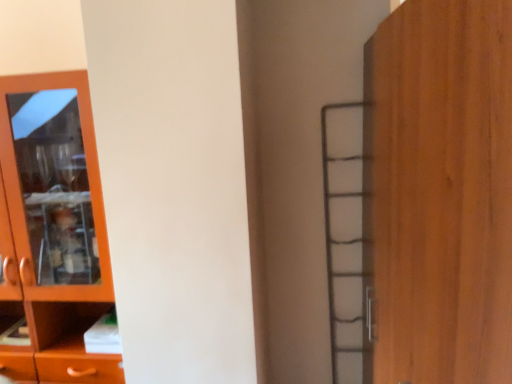
What is the approximate width of wooden door at right?

The width of wooden door at right is 21.90 inches.

The image size is (512, 384). In order to click on wooden door at right in this screenshot , I will do `click(443, 192)`.

Describe the element at coordinates (443, 192) in the screenshot. This screenshot has height=384, width=512. I see `wooden door at right` at that location.

Image resolution: width=512 pixels, height=384 pixels. Identify the location of matte wood cupboard at left. (52, 232).

Describe the element at coordinates (52, 232) in the screenshot. I see `matte wood cupboard at left` at that location.

Consider the image. Measure the distance between matte wood cupboard at left and camera.

matte wood cupboard at left is 4.48 feet away from camera.

You are a GUI agent. You are given a task and a screenshot of the screen. Output one action in this format:
    pyautogui.click(x=<x>, y=<y>)
    Task: Click on the wooden door at right
    The image size is (512, 384).
    Given the screenshot: What is the action you would take?
    pyautogui.click(x=443, y=192)

Between wooden door at right and matte wood cupboard at left, which one appears on the right side from the viewer's perspective?

Positioned to the right is wooden door at right.

Which object is closer to the camera, wooden door at right or matte wood cupboard at left?

wooden door at right is closer to the camera.

Is point (375, 357) farther from camera compared to point (29, 148)?

No, it is in front of (29, 148).

From the image's perspective, which is below, wooden door at right or matte wood cupboard at left?

wooden door at right.

From a real-world perspective, is wooden door at right located higher than matte wood cupboard at left?

Correct, in the physical world, wooden door at right is higher than matte wood cupboard at left.

In terms of width, does wooden door at right look wider or thinner when compared to matte wood cupboard at left?

wooden door at right is wider than matte wood cupboard at left.

Between wooden door at right and matte wood cupboard at left, which one has more height?

matte wood cupboard at left is taller.

Who is bigger, wooden door at right or matte wood cupboard at left?

With larger size is wooden door at right.

Is wooden door at right spatially inside matte wood cupboard at left, or outside of it?

The correct answer is: outside.

Is wooden door at right beside matte wood cupboard at left?

wooden door at right is not next to matte wood cupboard at left, and they're not touching.

Could you tell me if wooden door at right is turned towards matte wood cupboard at left?

Yes, wooden door at right is oriented towards matte wood cupboard at left.

How much distance is there between wooden door at right and matte wood cupboard at left?

A distance of 1.18 meters exists between wooden door at right and matte wood cupboard at left.

Identify the location of cupboard above the wooden door at right (from the image's perspective). The height and width of the screenshot is (384, 512). (52, 232).

Is matte wood cupboard at left to the right of wooden door at right from the viewer's perspective?

No.

Does matte wood cupboard at left come in front of wooden door at right?

No, matte wood cupboard at left is further to the viewer.

Considering the points (70, 72) and (457, 377), which point is behind, point (70, 72) or point (457, 377)?

The point (70, 72) is farther from the camera.

From the image's perspective, is matte wood cupboard at left positioned above or below wooden door at right?

matte wood cupboard at left is above wooden door at right.

From a real-world perspective, is matte wood cupboard at left on wooden door at right?

No, from a real-world perspective, matte wood cupboard at left is not on top of wooden door at right.

Considering the sizes of matte wood cupboard at left and wooden door at right in the image, is matte wood cupboard at left wider or thinner than wooden door at right?

Clearly, matte wood cupboard at left has less width compared to wooden door at right.

Considering the sizes of matte wood cupboard at left and wooden door at right in the image, is matte wood cupboard at left taller or shorter than wooden door at right?

matte wood cupboard at left is taller than wooden door at right.

Looking at the image, does matte wood cupboard at left seem bigger or smaller compared to wooden door at right?

Considering their sizes, matte wood cupboard at left takes up less space than wooden door at right.

Does matte wood cupboard at left contain wooden door at right?

No, wooden door at right is not surrounded by matte wood cupboard at left.

Are matte wood cupboard at left and wooden door at right located far from each other?

matte wood cupboard at left is positioned a significant distance from wooden door at right.

Does matte wood cupboard at left turn towards wooden door at right?

No, matte wood cupboard at left is not turned towards wooden door at right.

You are a GUI agent. You are given a task and a screenshot of the screen. Output one action in this format:
    pyautogui.click(x=<x>, y=<y>)
    Task: Click on the door below the matte wood cupboard at left (from the image's perspective)
    This screenshot has height=384, width=512.
    Given the screenshot: What is the action you would take?
    pyautogui.click(x=443, y=192)

This screenshot has width=512, height=384. Find the location of `door that appears below the matte wood cupboard at left (from the image's perspective)`. door that appears below the matte wood cupboard at left (from the image's perspective) is located at coordinates (443, 192).

Identify the location of door located above the matte wood cupboard at left (from a real-world perspective). This screenshot has height=384, width=512. (443, 192).